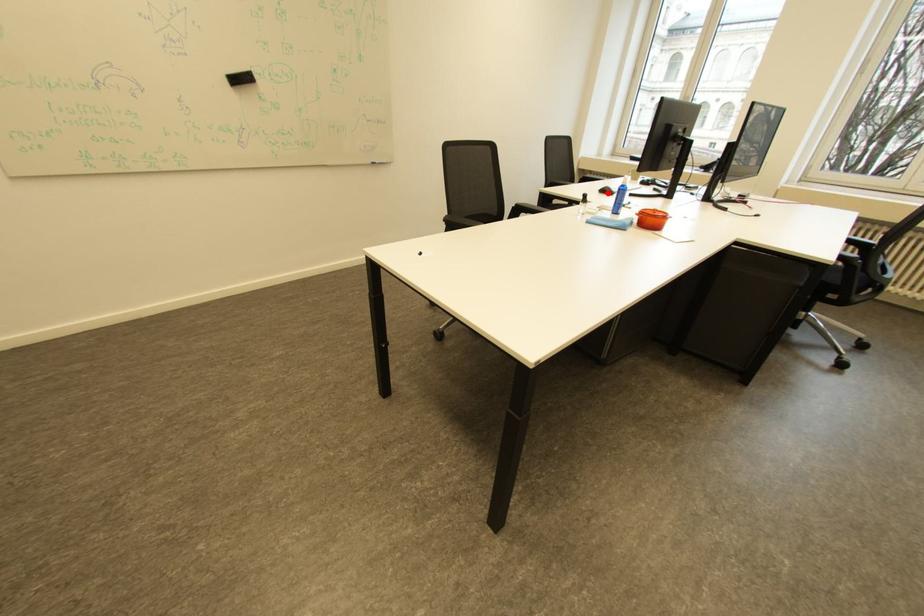
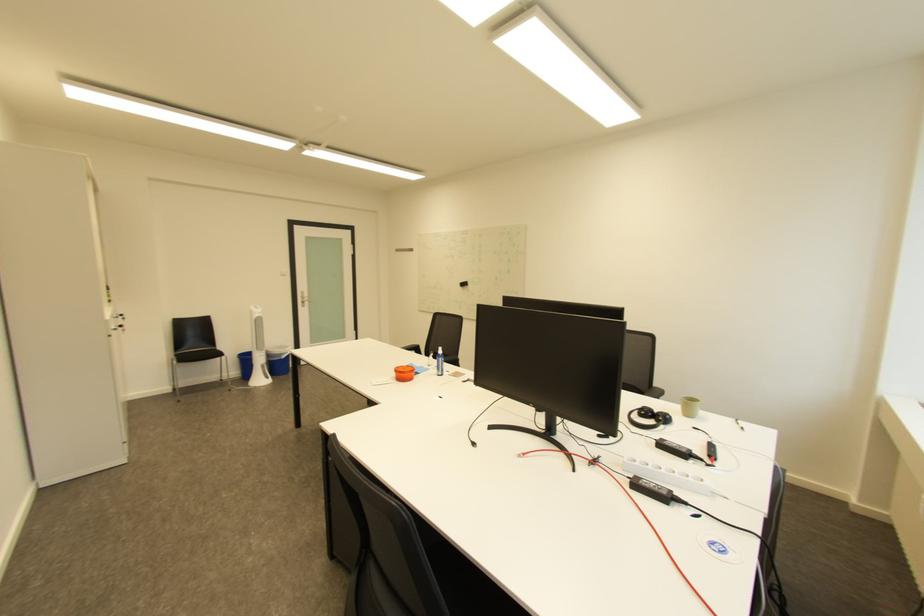
Question: I am providing you with two images of the same scene from different viewpoints. A red point is marked on the first image. Can you still see the location of the red point in image 2?

Choices:
 (A) Yes
 (B) No

Answer: (B)